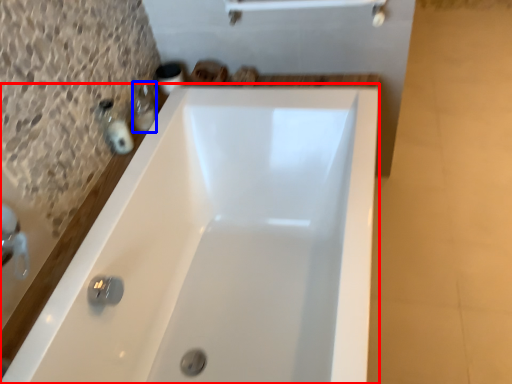
Question: Which object appears closest to the camera in this image, bathtub (highlighted by a red box) or toiletry (highlighted by a blue box)?

Choices:
 (A) bathtub
 (B) toiletry

Answer: (A)